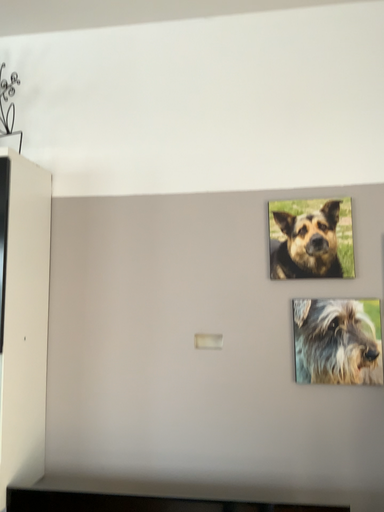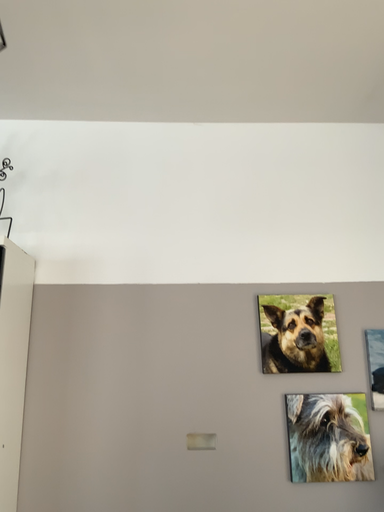
Question: How did the camera likely rotate when shooting the video?

Choices:
 (A) rotated right
 (B) rotated left

Answer: (A)